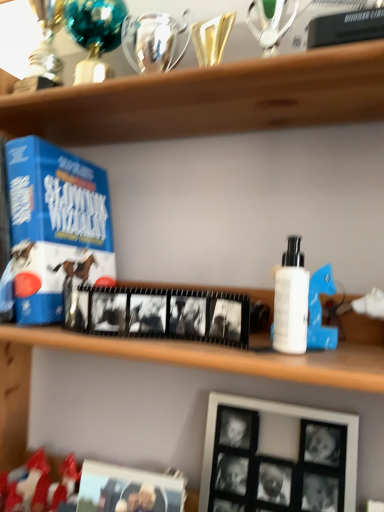
Question: Is black matte picture frame at lower right, which is counted as the first picture frame, starting from the right, oriented away from black matte picture frame at lower center, the second picture frame viewed from the right?

Choices:
 (A) yes
 (B) no

Answer: (B)

Question: From a real-world perspective, is black matte picture frame at lower right, which is counted as the first picture frame, starting from the right, positioned over black matte picture frame at lower center, which ranks as the first picture frame in left-to-right order, based on gravity?

Choices:
 (A) no
 (B) yes

Answer: (B)

Question: Does black matte picture frame at lower right, which is counted as the first picture frame, starting from the right, lie in front of black matte picture frame at lower center, the second picture frame viewed from the right?

Choices:
 (A) yes
 (B) no

Answer: (B)

Question: Is the position of black matte picture frame at lower right, which is the 2th picture frame from left to right, more distant than that of black matte picture frame at lower center, the second picture frame viewed from the right?

Choices:
 (A) no
 (B) yes

Answer: (B)

Question: Is black matte picture frame at lower right, which is the 2th picture frame from left to right, placed right next to black matte picture frame at lower center, which ranks as the first picture frame in left-to-right order?

Choices:
 (A) no
 (B) yes

Answer: (A)

Question: Is black matte picture frame at lower right, which is the 2th picture frame from left to right, at the right side of black matte picture frame at lower center, the second picture frame viewed from the right?

Choices:
 (A) no
 (B) yes

Answer: (B)

Question: From the image's perspective, would you say blue cardboard game at left is shown under black matte picture frame at lower right, which is counted as the first picture frame, starting from the right?

Choices:
 (A) no
 (B) yes

Answer: (A)

Question: Can we say blue cardboard game at left lies outside black matte picture frame at lower right, which is the 2th picture frame from left to right?

Choices:
 (A) no
 (B) yes

Answer: (B)

Question: Considering the relative sizes of blue cardboard game at left and black matte picture frame at lower right, which is counted as the first picture frame, starting from the right, in the image provided, is blue cardboard game at left taller than black matte picture frame at lower right, which is counted as the first picture frame, starting from the right,?

Choices:
 (A) yes
 (B) no

Answer: (A)

Question: Is blue cardboard game at left positioned with its back to black matte picture frame at lower right, which is counted as the first picture frame, starting from the right?

Choices:
 (A) yes
 (B) no

Answer: (B)

Question: Does blue cardboard game at left have a smaller size compared to black matte picture frame at lower right, which is the 2th picture frame from left to right?

Choices:
 (A) no
 (B) yes

Answer: (A)

Question: From the image's perspective, would you say blue cardboard game at left is positioned over black matte picture frame at lower right, which is the 2th picture frame from left to right?

Choices:
 (A) no
 (B) yes

Answer: (B)

Question: Is black matte picture frame at lower center, the second picture frame viewed from the right, positioned behind white matte bottle at right?

Choices:
 (A) no
 (B) yes

Answer: (B)